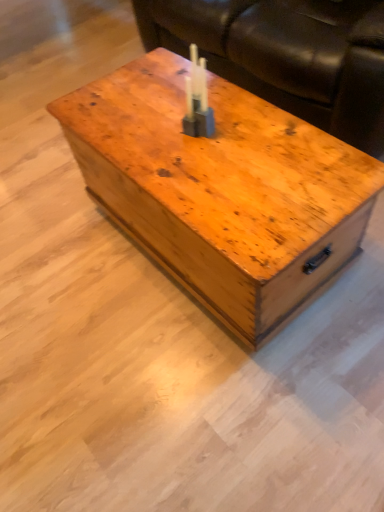
The height and width of the screenshot is (512, 384). Find the location of `spots to the right of translucent plastic candle at center`. spots to the right of translucent plastic candle at center is located at coordinates (249, 126).